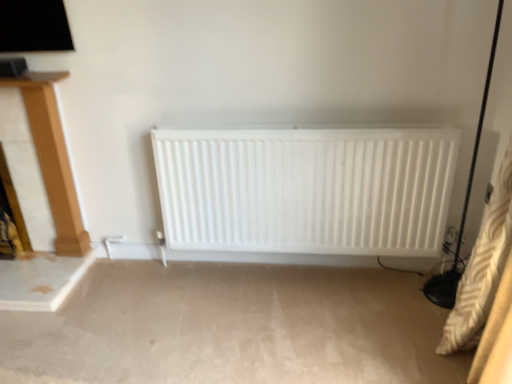
Question: Is wooden fireplace at left facing away from white matte radiator at center?

Choices:
 (A) yes
 (B) no

Answer: (B)

Question: Does wooden fireplace at left come behind white matte radiator at center?

Choices:
 (A) yes
 (B) no

Answer: (A)

Question: From the image's perspective, is wooden fireplace at left below white matte radiator at center?

Choices:
 (A) yes
 (B) no

Answer: (B)

Question: Is wooden fireplace at left at the left side of white matte radiator at center?

Choices:
 (A) no
 (B) yes

Answer: (B)

Question: Considering the relative sizes of wooden fireplace at left and white matte radiator at center in the image provided, is wooden fireplace at left shorter than white matte radiator at center?

Choices:
 (A) no
 (B) yes

Answer: (A)

Question: Considering the relative sizes of wooden fireplace at left and white matte radiator at center in the image provided, is wooden fireplace at left thinner than white matte radiator at center?

Choices:
 (A) no
 (B) yes

Answer: (B)

Question: Is white matte radiator at center positioned behind wooden fireplace at left?

Choices:
 (A) yes
 (B) no

Answer: (B)

Question: Is the depth of white matte radiator at center less than that of wooden fireplace at left?

Choices:
 (A) yes
 (B) no

Answer: (A)

Question: From a real-world perspective, does white matte radiator at center stand above wooden fireplace at left?

Choices:
 (A) no
 (B) yes

Answer: (A)

Question: Can you confirm if white matte radiator at center is thinner than wooden fireplace at left?

Choices:
 (A) no
 (B) yes

Answer: (A)

Question: From the image's perspective, is white matte radiator at center located beneath wooden fireplace at left?

Choices:
 (A) yes
 (B) no

Answer: (A)

Question: From the image's perspective, would you say white matte radiator at center is positioned over wooden fireplace at left?

Choices:
 (A) no
 (B) yes

Answer: (A)

Question: In the image, is white matte radiator at center positioned in front of or behind wooden fireplace at left?

Choices:
 (A) front
 (B) behind

Answer: (A)